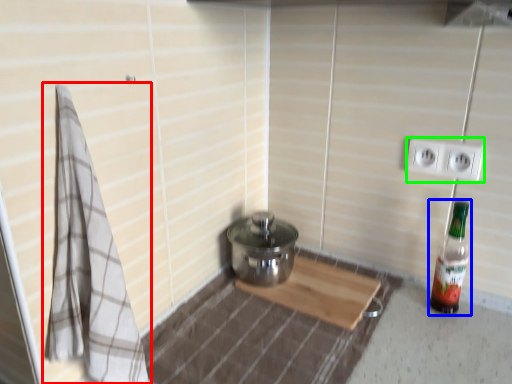
Question: Considering the real-world distances, which object is closest to bath towel (highlighted by a red box)? bottle (highlighted by a blue box) or electric outlet (highlighted by a green box).

Choices:
 (A) bottle
 (B) electric outlet

Answer: (A)